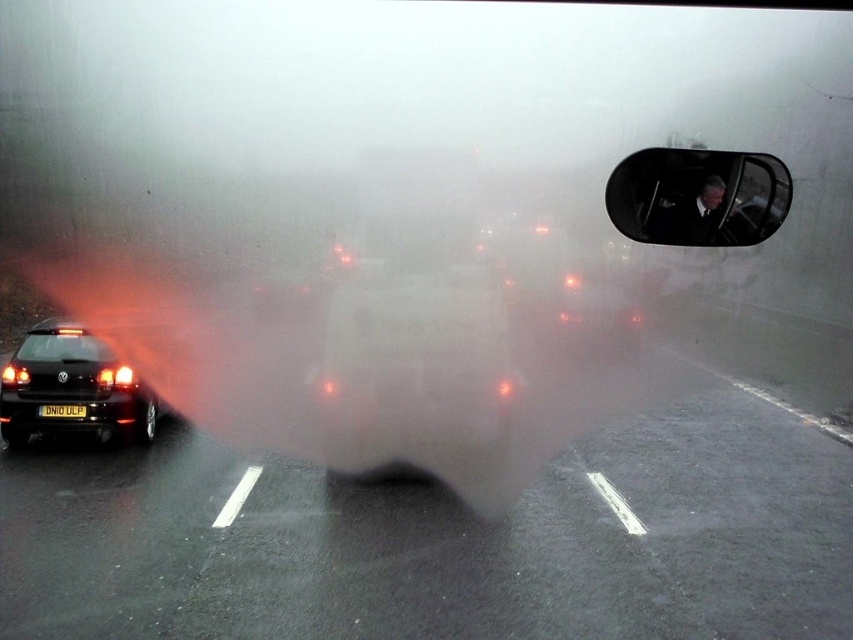
Question: Is black rubber car at left thinner than shiny black car at left?

Choices:
 (A) yes
 (B) no

Answer: (B)

Question: Is black rubber car at left wider than matte black car at left?

Choices:
 (A) no
 (B) yes

Answer: (B)

Question: Can you confirm if black rubber car at left is positioned below matte black car at left?

Choices:
 (A) no
 (B) yes

Answer: (B)

Question: Based on their relative distances, which object is nearer to the black plastic license plate at lower left?

Choices:
 (A) matte black car at left
 (B) black rubber car at left

Answer: (A)

Question: Which object is the closest to the black plastic license plate at lower left?

Choices:
 (A) black plastic view mirror at upper right
 (B) black rubber car at left

Answer: (B)

Question: Which of the following is the farthest from the observer?

Choices:
 (A) pyautogui.click(x=73, y=406)
 (B) pyautogui.click(x=68, y=332)
 (C) pyautogui.click(x=114, y=376)

Answer: (B)